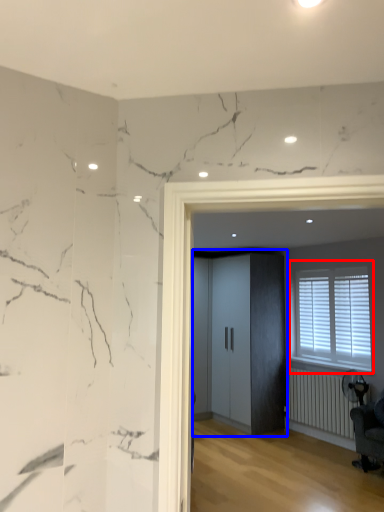
Question: Among these objects, which one is farthest to the camera, window (highlighted by a red box) or elevator (highlighted by a blue box)?

Choices:
 (A) window
 (B) elevator

Answer: (B)